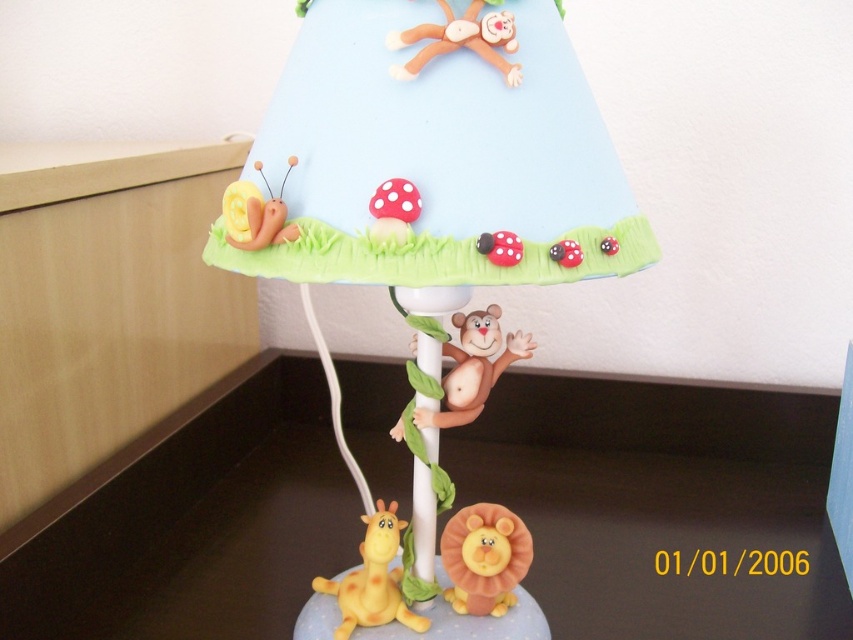
You are a child trying to place a sticker on the matte plastic lampshade at upper center and the yellow matte giraffe at lower left. Since the sticker is only 5 cm wide, which object can you cover more completely with the sticker?

The yellow matte giraffe at lower left is smaller than the matte plastic lampshade at upper center, so the sticker will cover more of the yellow matte giraffe at lower left.

You are a child trying to reach both the matte plastic lampshade at upper center and the matte plastic monkey at center. Your hand can extend 6 inches. Which one can you reach?

The matte plastic monkey at center is within reach because it is only 5.71 inches away from your hand, while the matte plastic lampshade at upper center is also reachable since both are within the 6 inches extension range.

You are a child trying to place a sticker on the matte plastic lampshade at upper center and the matte plastic monkey at center. Which object requires a larger sticker?

The matte plastic lampshade at upper center requires a larger sticker because it is bigger than the matte plastic monkey at center.